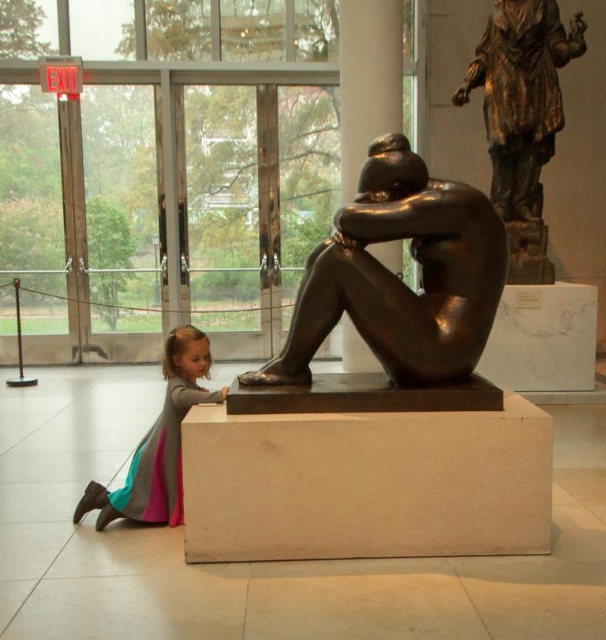
Question: Estimate the real-world distances between objects in this image. Which object is farther from the bronze statue at upper right?

Choices:
 (A) gray fabric dress at lower left
 (B) bronze/metallic figure at center

Answer: (A)

Question: Among these objects, which one is nearest to the camera?

Choices:
 (A) bronze statue at upper right
 (B) gray fabric dress at lower left

Answer: (B)

Question: Among these points, which one is nearest to the camera?

Choices:
 (A) (439, 296)
 (B) (170, 348)

Answer: (A)

Question: Where is bronze/metallic figure at center located in relation to gray fabric dress at lower left in the image?

Choices:
 (A) right
 (B) left

Answer: (A)

Question: Does bronze/metallic figure at center appear under bronze statue at upper right?

Choices:
 (A) yes
 (B) no

Answer: (A)

Question: Can you confirm if bronze statue at upper right is wider than gray fabric dress at lower left?

Choices:
 (A) no
 (B) yes

Answer: (B)